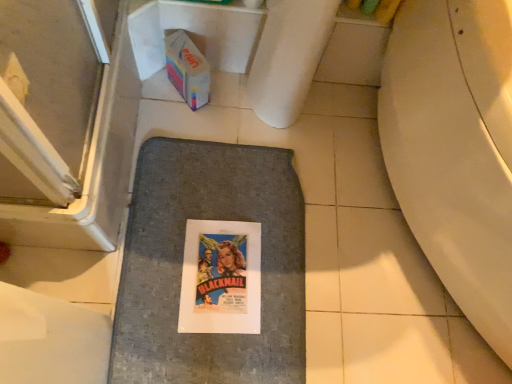
Find the location of `multicolored cardboard box at upper left`. multicolored cardboard box at upper left is located at coordinates (187, 69).

What do you see at coordinates (187, 69) in the screenshot? The width and height of the screenshot is (512, 384). I see `multicolored cardboard box at upper left` at bounding box center [187, 69].

Measure the distance between gray fabric bath mat at center and camera.

A distance of 3.38 feet exists between gray fabric bath mat at center and camera.

Describe the element at coordinates (178, 167) in the screenshot. I see `gray fabric bath mat at center` at that location.

Locate an element on the screen. gray fabric bath mat at center is located at coordinates (178, 167).

Find the location of a particular element. The height and width of the screenshot is (384, 512). multicolored cardboard box at upper left is located at coordinates (187, 69).

Is multicolored cardboard box at upper left at the left side of gray fabric bath mat at center?

Yes, multicolored cardboard box at upper left is to the left of gray fabric bath mat at center.

Which object is closer to the camera, multicolored cardboard box at upper left or gray fabric bath mat at center?

gray fabric bath mat at center is closer to the camera.

Which is behind, point (189, 84) or point (185, 174)?

The point (185, 174) is more distant.

From the image's perspective, between multicolored cardboard box at upper left and gray fabric bath mat at center, who is located below?

gray fabric bath mat at center is shown below in the image.

From a real-world perspective, is multicolored cardboard box at upper left positioned above or below gray fabric bath mat at center?

From a real-world perspective, multicolored cardboard box at upper left is physically above gray fabric bath mat at center.

Which of these two, multicolored cardboard box at upper left or gray fabric bath mat at center, is wider?

Wider between the two is gray fabric bath mat at center.

Can you confirm if multicolored cardboard box at upper left is taller than gray fabric bath mat at center?

Yes.

Can you confirm if multicolored cardboard box at upper left is smaller than gray fabric bath mat at center?

Correct, multicolored cardboard box at upper left occupies less space than gray fabric bath mat at center.

Is multicolored cardboard box at upper left not inside gray fabric bath mat at center?

Yes, multicolored cardboard box at upper left is not within gray fabric bath mat at center.

Is multicolored cardboard box at upper left with gray fabric bath mat at center?

No, multicolored cardboard box at upper left is not making contact with gray fabric bath mat at center.

Is multicolored cardboard box at upper left facing towards gray fabric bath mat at center?

No, multicolored cardboard box at upper left is not aimed at gray fabric bath mat at center.

Can you tell me how much multicolored cardboard box at upper left and gray fabric bath mat at center differ in facing direction?

144 degrees.

Locate an element on the screen. cardboard box above the gray fabric bath mat at center (from a real-world perspective) is located at coordinates (187, 69).

Visually, is gray fabric bath mat at center positioned to the left or to the right of multicolored cardboard box at upper left?

In the image, gray fabric bath mat at center appears on the right side of multicolored cardboard box at upper left.

Which object is closer to the camera taking this photo, gray fabric bath mat at center or multicolored cardboard box at upper left?

gray fabric bath mat at center.

Which point is more forward, [111,357] or [208,94]?

The point [111,357] is in front.

From the picture: From the image's perspective, is gray fabric bath mat at center over multicolored cardboard box at upper left?

No, from the image's perspective, gray fabric bath mat at center is not on top of multicolored cardboard box at upper left.

From a real-world perspective, is gray fabric bath mat at center physically below multicolored cardboard box at upper left?

Yes, from a real-world perspective, gray fabric bath mat at center is below multicolored cardboard box at upper left.

Which object is thinner, gray fabric bath mat at center or multicolored cardboard box at upper left?

Thinner between the two is multicolored cardboard box at upper left.

Considering the sizes of objects gray fabric bath mat at center and multicolored cardboard box at upper left in the image provided, who is shorter, gray fabric bath mat at center or multicolored cardboard box at upper left?

Standing shorter between the two is gray fabric bath mat at center.

Considering the sizes of objects gray fabric bath mat at center and multicolored cardboard box at upper left in the image provided, who is smaller, gray fabric bath mat at center or multicolored cardboard box at upper left?

With smaller size is multicolored cardboard box at upper left.

Do you think gray fabric bath mat at center is within multicolored cardboard box at upper left, or outside of it?

gray fabric bath mat at center lies outside multicolored cardboard box at upper left.

From the picture: Can you see gray fabric bath mat at center touching multicolored cardboard box at upper left?

gray fabric bath mat at center is not next to multicolored cardboard box at upper left, and they're not touching.

Could you tell me if gray fabric bath mat at center is turned towards multicolored cardboard box at upper left?

No, gray fabric bath mat at center is not oriented towards multicolored cardboard box at upper left.

This screenshot has height=384, width=512. I want to click on bath mat lying on the right of multicolored cardboard box at upper left, so click(x=178, y=167).

Where is `cardboard box located behind the gray fabric bath mat at center`? The width and height of the screenshot is (512, 384). cardboard box located behind the gray fabric bath mat at center is located at coordinates (187, 69).

The image size is (512, 384). I want to click on cardboard box above the gray fabric bath mat at center (from the image's perspective), so click(x=187, y=69).